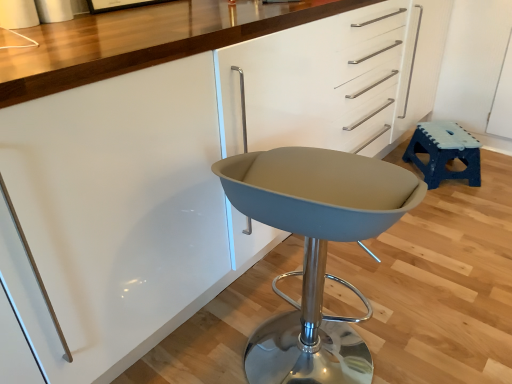
Image resolution: width=512 pixels, height=384 pixels. Identify the location of vacant space behind matte gray swivel chair at center. (302, 286).